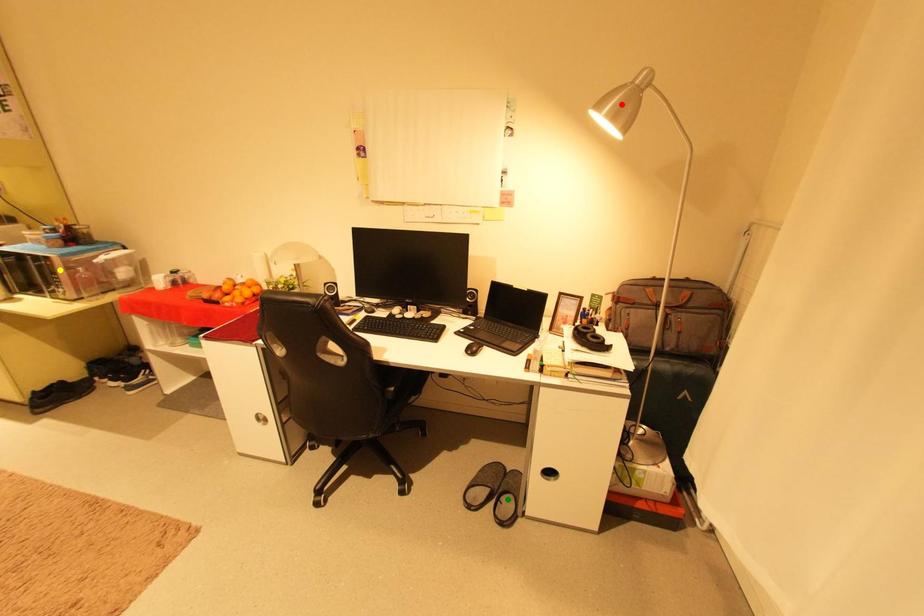
Based on the photo, order these from nearest to farthest:
- yellow point
- green point
- red point

red point → green point → yellow point